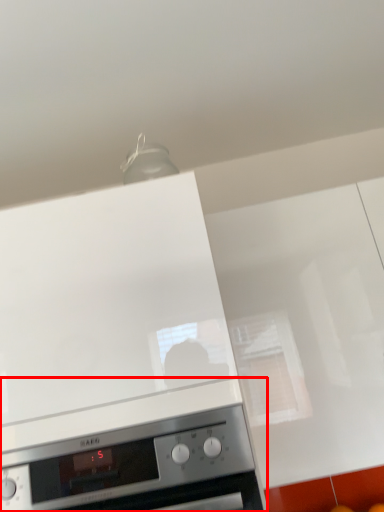
Question: From the image's perspective, considering the relative positions of home appliance (annotated by the red box) and home appliance in the image provided, where is home appliance (annotated by the red box) located with respect to the staircase?

Choices:
 (A) below
 (B) above

Answer: (A)